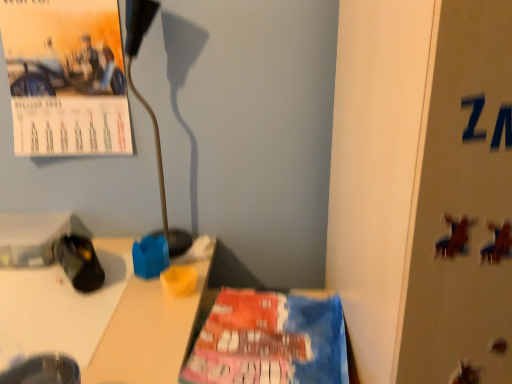
Question: Could you tell me if metallic gold lamp at upper left is turned towards black fabric shoe at lower left?

Choices:
 (A) yes
 (B) no

Answer: (B)

Question: From the image's perspective, is metallic gold lamp at upper left beneath black fabric shoe at lower left?

Choices:
 (A) no
 (B) yes

Answer: (A)

Question: From a real-world perspective, is metallic gold lamp at upper left below black fabric shoe at lower left?

Choices:
 (A) yes
 (B) no

Answer: (B)

Question: Does metallic gold lamp at upper left have a greater width compared to black fabric shoe at lower left?

Choices:
 (A) yes
 (B) no

Answer: (A)

Question: From a real-world perspective, does metallic gold lamp at upper left stand above black fabric shoe at lower left?

Choices:
 (A) no
 (B) yes

Answer: (B)

Question: Is black fabric shoe at lower left at the back of metallic gold lamp at upper left?

Choices:
 (A) no
 (B) yes

Answer: (A)

Question: Could you tell me if metallic silver bulletin board at right is turned towards matte paper calendar at upper left?

Choices:
 (A) no
 (B) yes

Answer: (A)

Question: Would you consider metallic silver bulletin board at right to be distant from matte paper calendar at upper left?

Choices:
 (A) no
 (B) yes

Answer: (A)

Question: Considering the relative positions of metallic silver bulletin board at right and matte paper calendar at upper left in the image provided, is metallic silver bulletin board at right to the left of matte paper calendar at upper left from the viewer's perspective?

Choices:
 (A) yes
 (B) no

Answer: (B)

Question: Is metallic silver bulletin board at right facing away from matte paper calendar at upper left?

Choices:
 (A) yes
 (B) no

Answer: (B)

Question: Is metallic silver bulletin board at right completely or partially outside of matte paper calendar at upper left?

Choices:
 (A) yes
 (B) no

Answer: (A)

Question: Can you confirm if metallic silver bulletin board at right is smaller than matte paper calendar at upper left?

Choices:
 (A) no
 (B) yes

Answer: (A)

Question: Is matte paper calendar at upper left thinner than metallic gold lamp at upper left?

Choices:
 (A) no
 (B) yes

Answer: (B)